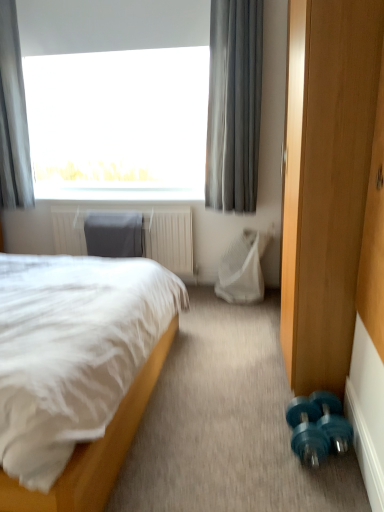
Question: From a real-world perspective, is teal plastic dumbbells at lower right located higher than gray sheer curtain at upper center, which is the 1th curtain in right-to-left order?

Choices:
 (A) yes
 (B) no

Answer: (B)

Question: Can you confirm if teal plastic dumbbells at lower right is thinner than gray sheer curtain at upper center, which is the 1th curtain in right-to-left order?

Choices:
 (A) no
 (B) yes

Answer: (A)

Question: Is teal plastic dumbbells at lower right touching gray sheer curtain at upper center, which is the 1th curtain in right-to-left order?

Choices:
 (A) no
 (B) yes

Answer: (A)

Question: Can you confirm if teal plastic dumbbells at lower right is positioned to the right of gray sheer curtain at upper center, acting as the 2th curtain starting from the left?

Choices:
 (A) yes
 (B) no

Answer: (A)

Question: From the image's perspective, is teal plastic dumbbells at lower right on top of gray sheer curtain at upper center, which is the 1th curtain in right-to-left order?

Choices:
 (A) no
 (B) yes

Answer: (A)

Question: Is teal plastic dumbbells at lower right aimed at gray sheer curtain at upper center, acting as the 2th curtain starting from the left?

Choices:
 (A) yes
 (B) no

Answer: (A)

Question: Does gray fabric curtain at upper left, the first curtain viewed from the left, have a larger size compared to teal plastic dumbbells at lower right?

Choices:
 (A) yes
 (B) no

Answer: (B)

Question: Is the position of gray fabric curtain at upper left, which is the 2th curtain in right-to-left order, more distant than that of teal plastic dumbbells at lower right?

Choices:
 (A) yes
 (B) no

Answer: (A)

Question: Is gray fabric curtain at upper left, the first curtain viewed from the left, positioned beyond the bounds of teal plastic dumbbells at lower right?

Choices:
 (A) no
 (B) yes

Answer: (B)

Question: From the image's perspective, is gray fabric curtain at upper left, the first curtain viewed from the left, under teal plastic dumbbells at lower right?

Choices:
 (A) no
 (B) yes

Answer: (A)

Question: Can you confirm if gray fabric curtain at upper left, which is the 2th curtain in right-to-left order, is wider than teal plastic dumbbells at lower right?

Choices:
 (A) no
 (B) yes

Answer: (A)

Question: Is gray fabric curtain at upper left, the first curtain viewed from the left, far away from teal plastic dumbbells at lower right?

Choices:
 (A) yes
 (B) no

Answer: (A)

Question: Is gray fabric curtain at upper left, which is the 2th curtain in right-to-left order, outside white mesh swivel chair at center, which is the second swivel chair in left-to-right order?

Choices:
 (A) yes
 (B) no

Answer: (A)